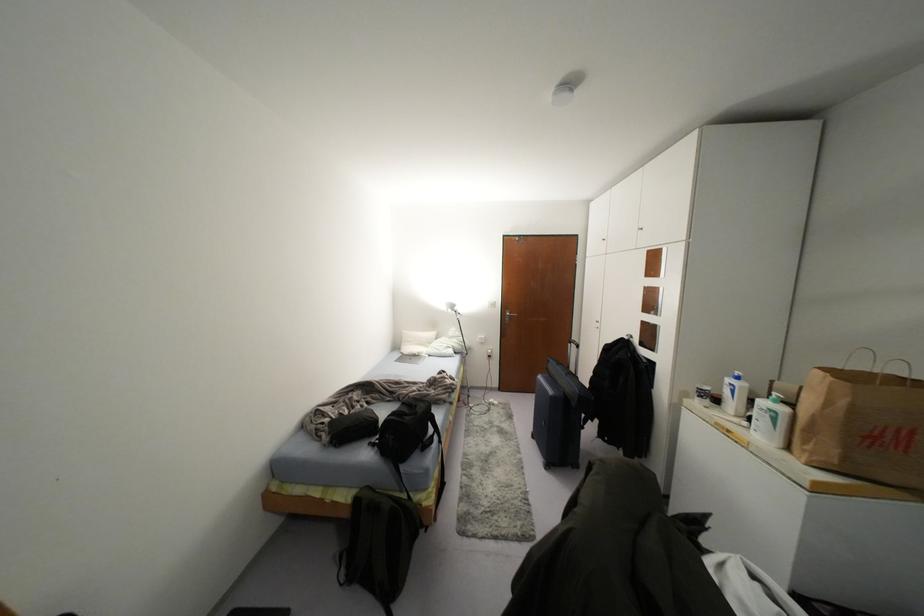
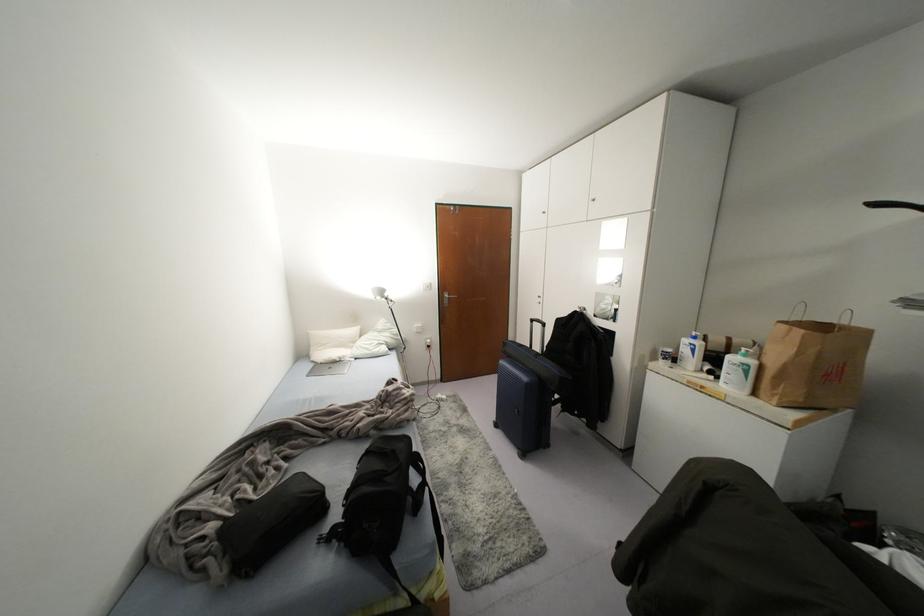
Find the pixel in the second image that matches the point at 414,355 in the first image.

(334, 361)